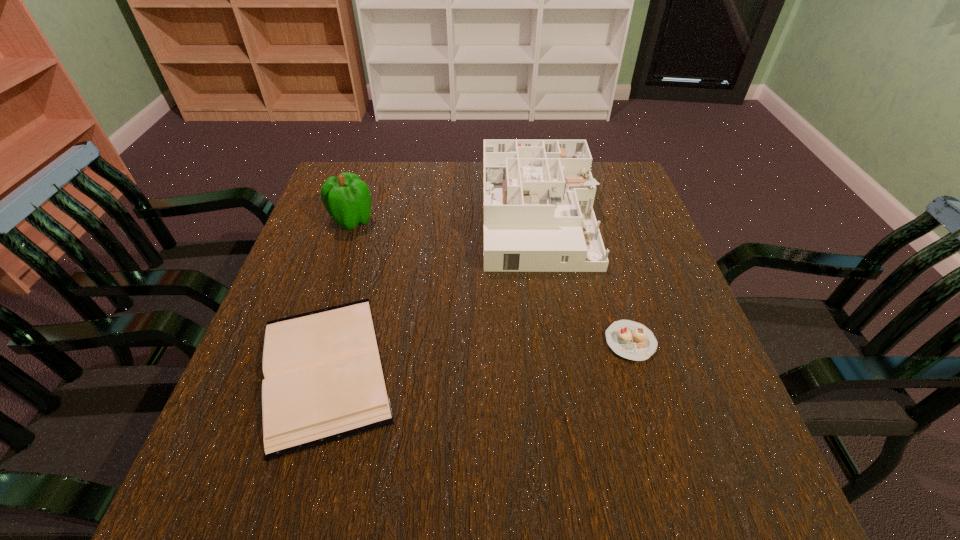
Find the location of `free space at the left edge of the desktop`. free space at the left edge of the desktop is located at coordinates (324, 266).

Image resolution: width=960 pixels, height=540 pixels. Find the location of `vacant space at the right edge of the desktop`. vacant space at the right edge of the desktop is located at coordinates (640, 211).

Locate an element on the screen. Image resolution: width=960 pixels, height=540 pixels. free point at the near left corner is located at coordinates (260, 491).

This screenshot has height=540, width=960. I want to click on free region at the near right corner, so click(x=684, y=461).

Where is `vacant region between the third tallest object and the hardback book`? The image size is (960, 540). vacant region between the third tallest object and the hardback book is located at coordinates (478, 355).

The height and width of the screenshot is (540, 960). I want to click on free point between the shortest object and the bell pepper, so click(339, 294).

Identify the location of empty location between the dollhouse and the shortest object. (432, 293).

At what (x,y) coordinates should I click in order to perform the action: click on free space between the dollhouse and the cupcake. Please return your answer as a coordinate pair (x, y). Image resolution: width=960 pixels, height=540 pixels. Looking at the image, I should click on (585, 280).

Find the location of a particular element. free spot between the second shortest object and the shortest object is located at coordinates (478, 355).

The image size is (960, 540). Identify the location of free space between the bell pepper and the third tallest object. click(x=492, y=281).